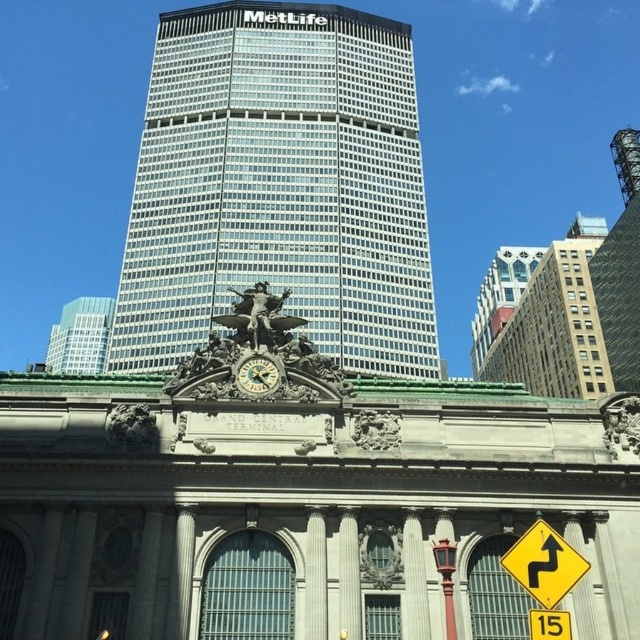
You are standing in front of Grand Central Terminal and want to take a photo that includes both the Grand Central Terminal and the MetLife Building. You notice two points marked on your camera screen at coordinates point (273, 388) and point (445, 636). Which point is closer to you?

Point (273, 388) is closer to you because it is further to the camera than point (445, 636).

You are a photographer standing in front of Grand Central Terminal. You want to capture both the glassy skyscraper at upper left and the red wood pole at center in your shot. Which object will appear larger in your photo?

The glassy skyscraper at upper left will appear larger in the photo because it is bigger than the red wood pole at center.

You are standing in front of Grand Central Terminal and the MetLife Building. You notice two points marked in the image. The first point is at coordinates point (525, 568) and the second point is at coordinates point (88, 317). Which of these two points is closer to your current position?

Point (525, 568) is closer to the camera than point (88, 317), so the first point is closer to your current position.